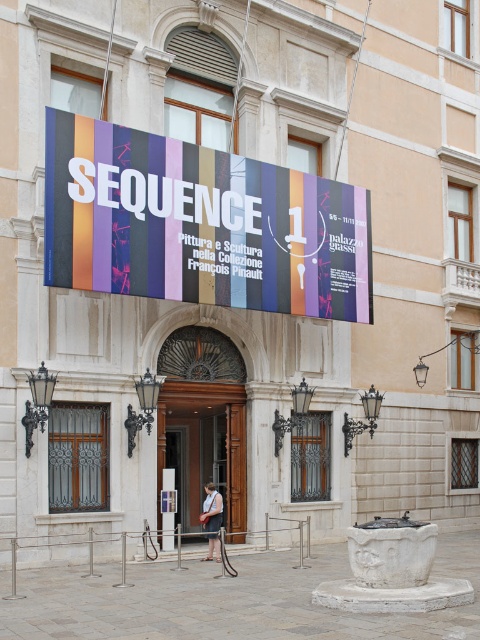
Is multicolored fabric banner at center positioned behind white cotton dress at center?

No, it is not.

Which is behind, point (348, 189) or point (219, 516)?

The point (348, 189) is more distant.

Is point (83, 188) behind point (212, 506)?

No.

The height and width of the screenshot is (640, 480). I want to click on multicolored fabric banner at center, so click(200, 225).

This screenshot has height=640, width=480. What do you see at coordinates (205, 444) in the screenshot?
I see `brown wooden door at center` at bounding box center [205, 444].

Is brown wooden door at center to the left of white cotton dress at center from the viewer's perspective?

Correct, you'll find brown wooden door at center to the left of white cotton dress at center.

Locate an element on the screen. The image size is (480, 640). brown wooden door at center is located at coordinates (205, 444).

Does multicolored fabric banner at center appear under brown wooden door at center?

Actually, multicolored fabric banner at center is above brown wooden door at center.

Can you confirm if multicolored fabric banner at center is smaller than brown wooden door at center?

No, multicolored fabric banner at center is not smaller than brown wooden door at center.

This screenshot has width=480, height=640. What do you see at coordinates (200, 225) in the screenshot? I see `multicolored fabric banner at center` at bounding box center [200, 225].

Locate an element on the screen. This screenshot has height=640, width=480. multicolored fabric banner at center is located at coordinates (200, 225).